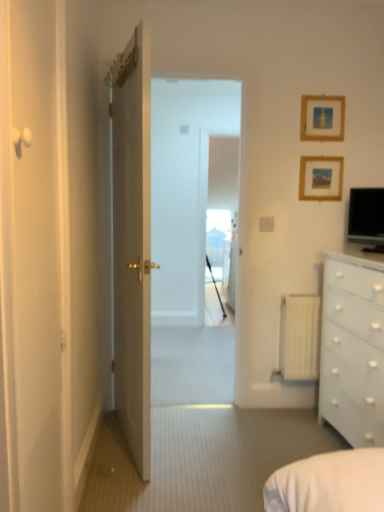
Based on the photo, in order to face wooden picture frame at upper right, the 2th picture frame in the bottom-to-top sequence, should I rotate leftwards or rightwards?

Turn right by 17.033 degrees to look at wooden picture frame at upper right, the 2th picture frame in the bottom-to-top sequence.

What do you see at coordinates (299, 337) in the screenshot?
I see `white matte radiator at right` at bounding box center [299, 337].

Find the location of a particular element. black glossy monitor at upper right is located at coordinates (367, 217).

Describe the element at coordinates (367, 217) in the screenshot. Image resolution: width=384 pixels, height=512 pixels. I see `black glossy monitor at upper right` at that location.

The height and width of the screenshot is (512, 384). What do you see at coordinates (132, 242) in the screenshot?
I see `white glossy door at center, acting as the 1th door starting from the back` at bounding box center [132, 242].

Describe the element at coordinates (321, 178) in the screenshot. I see `wooden picture frame at upper right, which is counted as the 1th picture frame, starting from the bottom` at that location.

Image resolution: width=384 pixels, height=512 pixels. Describe the element at coordinates (353, 352) in the screenshot. I see `white glossy chest of drawers at right` at that location.

Locate an element on the screen. The width and height of the screenshot is (384, 512). wooden picture frame at upper right, the 2th picture frame in the bottom-to-top sequence is located at coordinates (322, 118).

Find the location of a particular element. door that is the 2nd object located above the white glossy chest of drawers at right (from the image's perspective) is located at coordinates (132, 242).

Is white glossy chest of drawers at right facing towards white glossy door at center, placed as the second door when sorted from front to back?

Yes, white glossy chest of drawers at right is turned towards white glossy door at center, placed as the second door when sorted from front to back.

Who is taller, white glossy chest of drawers at right or white glossy door at center, placed as the second door when sorted from front to back?

white glossy door at center, placed as the second door when sorted from front to back, is taller.

Does point (330, 271) lie in front of point (137, 147)?

No, it is behind (137, 147).

In the scene shown: What's the angular difference between white matte radiator at right and wooden picture frame at upper right, the 1th picture frame positioned from the top,'s facing directions?

The facing directions of white matte radiator at right and wooden picture frame at upper right, the 1th picture frame positioned from the top, are 0.777 degrees apart.

Is the surface of white matte radiator at right in direct contact with wooden picture frame at upper right, the 1th picture frame positioned from the top?

No, white matte radiator at right is not with wooden picture frame at upper right, the 1th picture frame positioned from the top.

Is white matte radiator at right facing away from wooden picture frame at upper right, the 2th picture frame in the bottom-to-top sequence?

No.

Does white matte radiator at right have a lesser width compared to wooden picture frame at upper right, the 1th picture frame positioned from the top?

No.

At what (x,y) coordinates should I click in order to perform the action: click on window behind the white glossy chest of drawers at right. Please return your answer as a coordinate pair (x, y). Looking at the image, I should click on (219, 243).

Which point is more forward, (349,434) or (212,240)?

The point (349,434) is in front.

From the picture: Is white glossy chest of drawers at right wider or thinner than transparent glass window at center?

white glossy chest of drawers at right is wider than transparent glass window at center.

Is white glossy door at left, the first door positioned from the front, further to camera compared to transparent glass window at center?

No, white glossy door at left, the first door positioned from the front, is in front of transparent glass window at center.

Which is in front, point (13, 161) or point (226, 225)?

The point (13, 161) is closer.

Based on their sizes in the image, would you say white glossy door at left, the second door in the back-to-front sequence, is bigger or smaller than transparent glass window at center?

Considering their sizes, white glossy door at left, the second door in the back-to-front sequence, takes up less space than transparent glass window at center.

From a real-world perspective, relative to transparent glass window at center, is white glossy door at left, the second door in the back-to-front sequence, vertically above or below?

white glossy door at left, the second door in the back-to-front sequence, is situated higher than transparent glass window at center in the real world.

Could you tell me if white glossy door at left, the first door positioned from the front, is turned towards white matte radiator at right?

No, white glossy door at left, the first door positioned from the front, is not oriented towards white matte radiator at right.

Looking at the image, does white glossy door at left, the first door positioned from the front, seem bigger or smaller compared to white matte radiator at right?

In the image, white glossy door at left, the first door positioned from the front, appears to be larger than white matte radiator at right.

Who is taller, white glossy door at left, the second door in the back-to-front sequence, or white matte radiator at right?

white glossy door at left, the second door in the back-to-front sequence.

Looking at this image, is white glossy door at left, the second door in the back-to-front sequence, to the left of white matte radiator at right from the viewer's perspective?

Indeed, white glossy door at left, the second door in the back-to-front sequence, is positioned on the left side of white matte radiator at right.

Between white matte radiator at right and white glossy chest of drawers at right, which one is positioned behind?

white matte radiator at right.

From a real-world perspective, which object rests below the other?

white matte radiator at right is physically lower.

Is white matte radiator at right to the left of white glossy chest of drawers at right from the viewer's perspective?

Yes, white matte radiator at right is to the left of white glossy chest of drawers at right.

From a real-world perspective, is wooden picture frame at upper right, which is counted as the 1th picture frame, starting from the bottom, above or below white matte radiator at right?

wooden picture frame at upper right, which is counted as the 1th picture frame, starting from the bottom, is above white matte radiator at right.

Is wooden picture frame at upper right, the second picture frame when ordered from top to bottom, positioned beyond the bounds of white matte radiator at right?

Yes, wooden picture frame at upper right, the second picture frame when ordered from top to bottom, is outside of white matte radiator at right.

Is wooden picture frame at upper right, the second picture frame when ordered from top to bottom, directly adjacent to white matte radiator at right?

wooden picture frame at upper right, the second picture frame when ordered from top to bottom, and white matte radiator at right are not in contact.

From the image's perspective, is wooden picture frame at upper right, which is counted as the 1th picture frame, starting from the bottom, beneath white matte radiator at right?

Incorrect, from the image's perspective, wooden picture frame at upper right, which is counted as the 1th picture frame, starting from the bottom, is higher than white matte radiator at right.

Find the location of a particular element. the chest of drawers that appears below the white glossy door at center, acting as the 1th door starting from the back (from the image's perspective) is located at coordinates (353, 352).

Find the location of a particular element. Image resolution: width=384 pixels, height=512 pixels. picture frame that is the 2nd object above the white matte radiator at right (from a real-world perspective) is located at coordinates (322, 118).

When comparing their distances from white glossy door at center, acting as the 1th door starting from the back, does wooden picture frame at upper right, the second picture frame when ordered from top to bottom, or white matte radiator at right seem further?

wooden picture frame at upper right, the second picture frame when ordered from top to bottom.

Estimate the real-world distances between objects in this image. Which object is closer to wooden picture frame at upper right, which is counted as the 1th picture frame, starting from the bottom, transparent glass window at center or black glossy monitor at upper right?

Among the two, black glossy monitor at upper right is located nearer to wooden picture frame at upper right, which is counted as the 1th picture frame, starting from the bottom.

Looking at the image, which one is located closer to black glossy monitor at upper right, wooden picture frame at upper right, the 2th picture frame in the bottom-to-top sequence, or white matte radiator at right?

wooden picture frame at upper right, the 2th picture frame in the bottom-to-top sequence.

Estimate the real-world distances between objects in this image. Which object is further from black glossy monitor at upper right, white glossy door at left, the first door positioned from the front, or white matte radiator at right?

Based on the image, white glossy door at left, the first door positioned from the front, appears to be further to black glossy monitor at upper right.

Estimate the real-world distances between objects in this image. Which object is closer to white matte radiator at right, white glossy chest of drawers at right or white glossy door at center, acting as the 1th door starting from the back?

white glossy chest of drawers at right.

Based on their spatial positions, is white glossy door at center, acting as the 1th door starting from the back, or black glossy monitor at upper right further from white glossy door at left, the second door in the back-to-front sequence?

black glossy monitor at upper right.

Looking at the image, which one is located closer to wooden picture frame at upper right, which is counted as the 1th picture frame, starting from the bottom, white glossy door at center, acting as the 1th door starting from the back, or white glossy door at left, the second door in the back-to-front sequence?

Among the two, white glossy door at center, acting as the 1th door starting from the back, is located nearer to wooden picture frame at upper right, which is counted as the 1th picture frame, starting from the bottom.

Based on their spatial positions, is black glossy monitor at upper right or transparent glass window at center further from wooden picture frame at upper right, the 1th picture frame positioned from the top?

Based on the image, transparent glass window at center appears to be further to wooden picture frame at upper right, the 1th picture frame positioned from the top.

Locate an element on the screen. picture frame between wooden picture frame at upper right, the 2th picture frame in the bottom-to-top sequence, and white matte radiator at right vertically is located at coordinates coord(321,178).

This screenshot has width=384, height=512. In order to click on television between white glossy door at left, the first door positioned from the front, and transparent glass window at center from front to back in this screenshot , I will do [367, 217].

I want to click on picture frame between wooden picture frame at upper right, the 2th picture frame in the bottom-to-top sequence, and white glossy chest of drawers at right, in the vertical direction, so click(x=321, y=178).

Identify the location of picture frame between white glossy door at center, acting as the 1th door starting from the back, and wooden picture frame at upper right, which is counted as the 1th picture frame, starting from the bottom, from left to right. (322, 118).